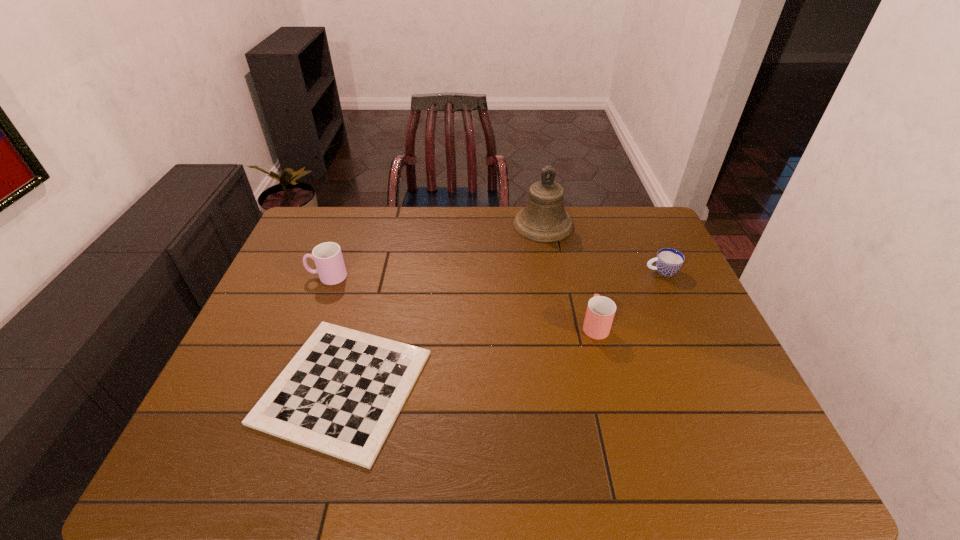
Find the location of a particular element. The height and width of the screenshot is (540, 960). the tallest object is located at coordinates (544, 219).

I want to click on bell, so click(x=544, y=219).

Where is `the leftmost cup`? The height and width of the screenshot is (540, 960). the leftmost cup is located at coordinates pos(327,256).

Locate an element on the screen. the second cup from left to right is located at coordinates (600, 312).

You are a GUI agent. You are given a task and a screenshot of the screen. Output one action in this format:
    pyautogui.click(x=<x>, y=<y>)
    Task: Click on the rightmost object
    
    Given the screenshot: What is the action you would take?
    pyautogui.click(x=668, y=261)

Find the location of `the rightmost cup`. the rightmost cup is located at coordinates (668, 261).

The width and height of the screenshot is (960, 540). What are the coordinates of `the shortest object` in the screenshot? It's located at pos(341,393).

Image resolution: width=960 pixels, height=540 pixels. In order to click on vacant area situated on the right of the farthest object in this screenshot , I will do `click(599, 225)`.

I want to click on free space located with the handle on the side of the leftmost cup, so click(282, 276).

Where is `free location located 0.050m on the side of the nearest cup with the handle`? Image resolution: width=960 pixels, height=540 pixels. free location located 0.050m on the side of the nearest cup with the handle is located at coordinates (588, 299).